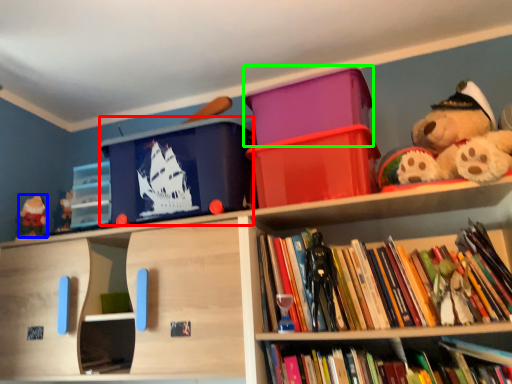
Question: Which object is the farthest from storage box (highlighted by a red box)? Choose among these: toy (highlighted by a blue box) or storage box (highlighted by a green box).

Choices:
 (A) toy
 (B) storage box

Answer: (A)